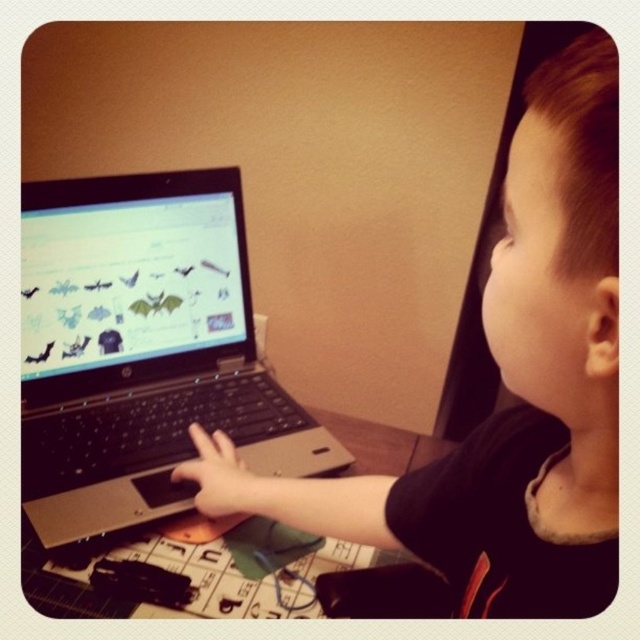
Question: Which point appears farthest from the camera in this image?

Choices:
 (A) (216, 432)
 (B) (116, 285)

Answer: (B)

Question: Can you confirm if shiny silver laptop at center is wider than matte black hand at center?

Choices:
 (A) no
 (B) yes

Answer: (B)

Question: Is shiny silver laptop at center closer to the viewer compared to matte black hand at center?

Choices:
 (A) yes
 (B) no

Answer: (B)

Question: Can you confirm if black matte laptop at left is wider than silver/black laptop at center?

Choices:
 (A) yes
 (B) no

Answer: (B)

Question: Which point appears closest to the camera in this image?

Choices:
 (A) (410, 451)
 (B) (214, 449)
 (C) (545, 324)
 (D) (241, 305)

Answer: (C)

Question: Which object is the closest to the black matte laptop at left?

Choices:
 (A) matte black hand at center
 (B) wooden table at center
 (C) silver/black laptop at center

Answer: (A)